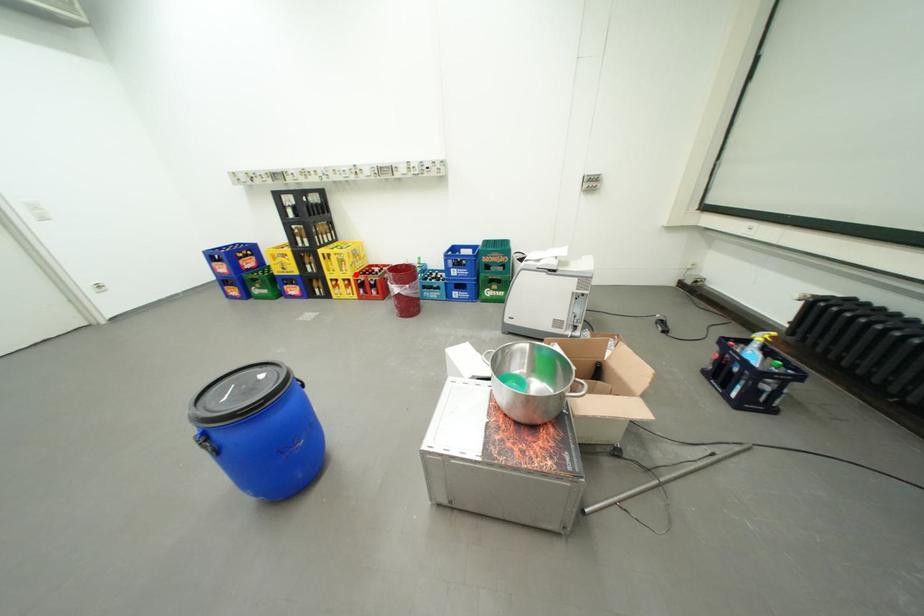
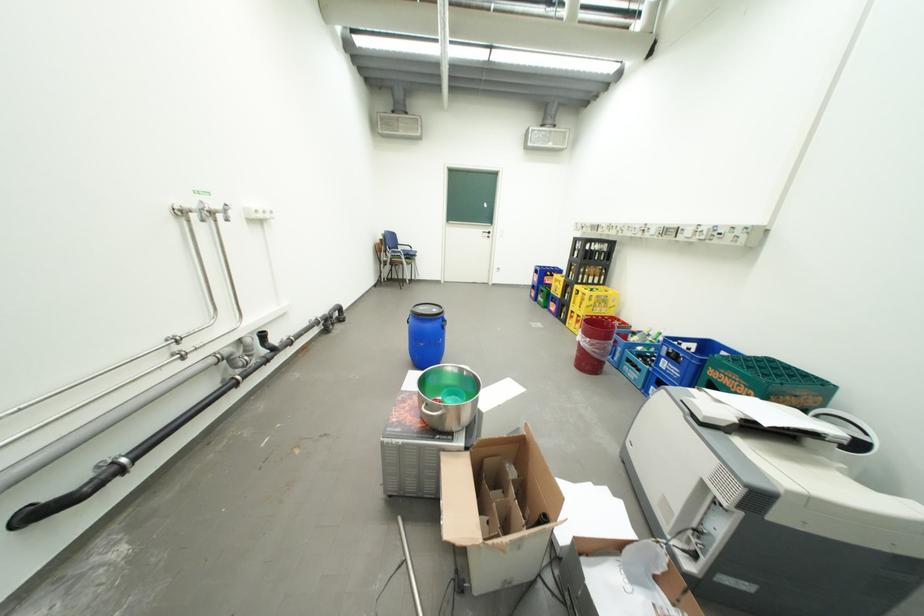
Question: I am providing you with two images of the same scene from different viewpoints. A red point is shown in image1. For the corresponding object point in image2, is it positioned nearer or farther from the camera?

Choices:
 (A) Nearer
 (B) Farther

Answer: (A)